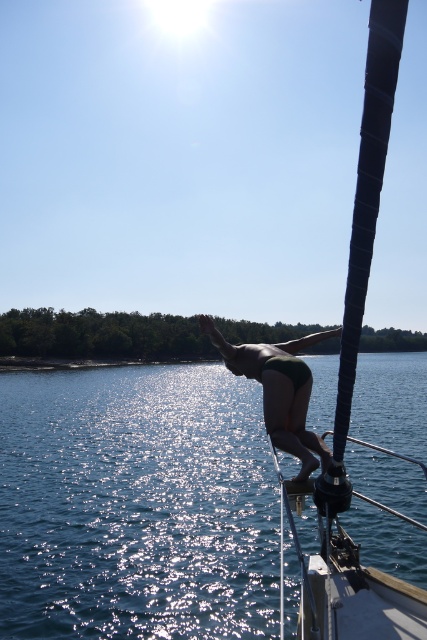
Is point (85, 536) positioned after point (325, 449)?

Yes, point (85, 536) is behind point (325, 449).

Between shiny blue water at center and green matte bikini at center, which one appears on the left side from the viewer's perspective?

From the viewer's perspective, green matte bikini at center appears more on the left side.

Who is more forward, [377,518] or [222,344]?

Point [222,344] is more forward.

Locate an element on the screen. This screenshot has height=640, width=427. shiny blue water at center is located at coordinates (137, 506).